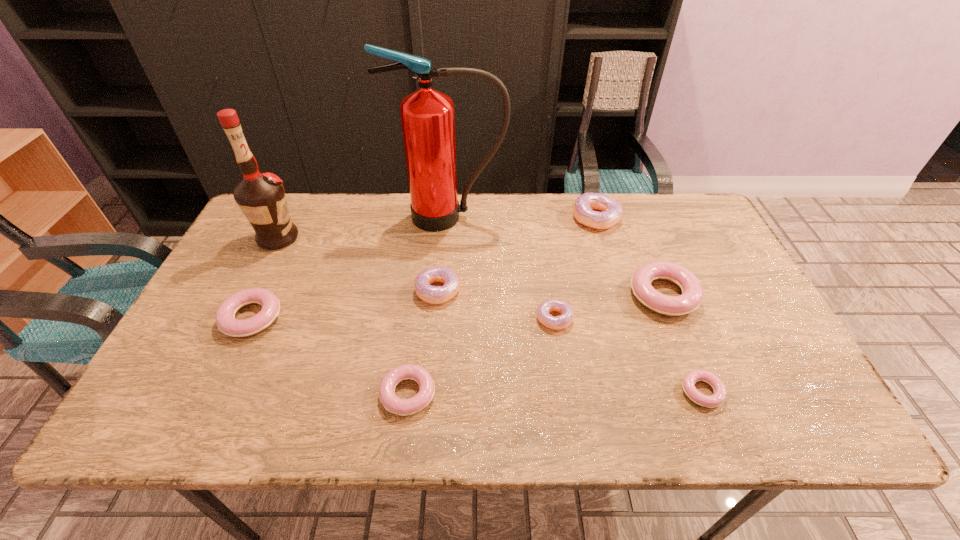
Locate an element on the screen. The width and height of the screenshot is (960, 540). the fourth doughnut from left to right is located at coordinates (560, 322).

Identify the location of the second smallest pink doughnut. (392, 403).

The image size is (960, 540). What are the coordinates of `the smallest pink doughnut` in the screenshot? It's located at (689, 380).

At what (x,y) coordinates should I click in order to perform the action: click on the shortest doughnut. Please return your answer as a coordinate pair (x, y). The height and width of the screenshot is (540, 960). Looking at the image, I should click on (689, 380).

This screenshot has height=540, width=960. In order to click on free location located on the front of the fire extinguisher in this screenshot , I will do `click(441, 323)`.

The width and height of the screenshot is (960, 540). Find the location of `vacant point located on the front and back of the liquor`. vacant point located on the front and back of the liquor is located at coordinates [x=319, y=238].

I want to click on vacant region located on the right of the farthest purple doughnut, so click(670, 218).

This screenshot has width=960, height=540. I want to click on free spot located 0.340m on the back of the biggest pink doughnut, so click(626, 201).

What are the coordinates of `vacant space positioned 0.320m on the left of the second biggest purple doughnut` in the screenshot? It's located at (297, 290).

Locate an element on the screen. The height and width of the screenshot is (540, 960). vacant position located 0.310m on the back of the leftmost pink doughnut is located at coordinates (297, 224).